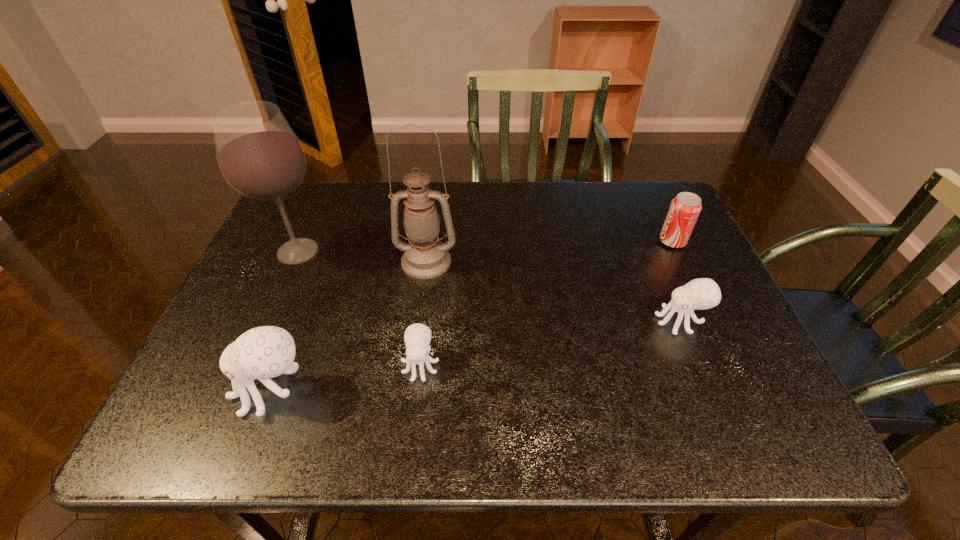
Find the location of a particular element. free location at the far right corner of the desktop is located at coordinates (619, 183).

Where is `free space between the shortest object and the tallest octopus`? The height and width of the screenshot is (540, 960). free space between the shortest object and the tallest octopus is located at coordinates (347, 377).

Where is `free space that is in between the third nearest object and the alcohol`? free space that is in between the third nearest object and the alcohol is located at coordinates (489, 286).

I want to click on vacant region between the fourth farthest object and the soda can, so click(x=676, y=281).

Image resolution: width=960 pixels, height=540 pixels. Identify the location of free spot between the soda can and the tallest octopus. (472, 315).

Where is `vacant region between the soda can and the oil lamp`? vacant region between the soda can and the oil lamp is located at coordinates (549, 252).

Image resolution: width=960 pixels, height=540 pixels. In order to click on vacant space that is in between the alcohol and the farthest octopus in this screenshot , I will do `click(489, 286)`.

Identify the location of vacant area that lies between the shortest object and the soda can. The height and width of the screenshot is (540, 960). (546, 303).

Locate an element on the screen. This screenshot has height=540, width=960. unoccupied area between the oil lamp and the shortest object is located at coordinates (423, 313).

The image size is (960, 540). I want to click on free point between the fourth farthest object and the oil lamp, so click(x=553, y=291).